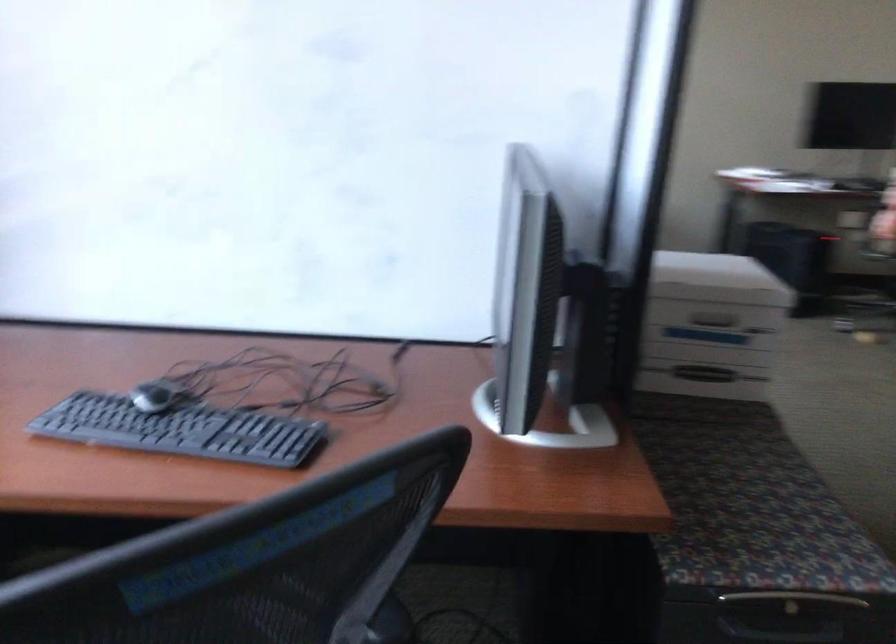
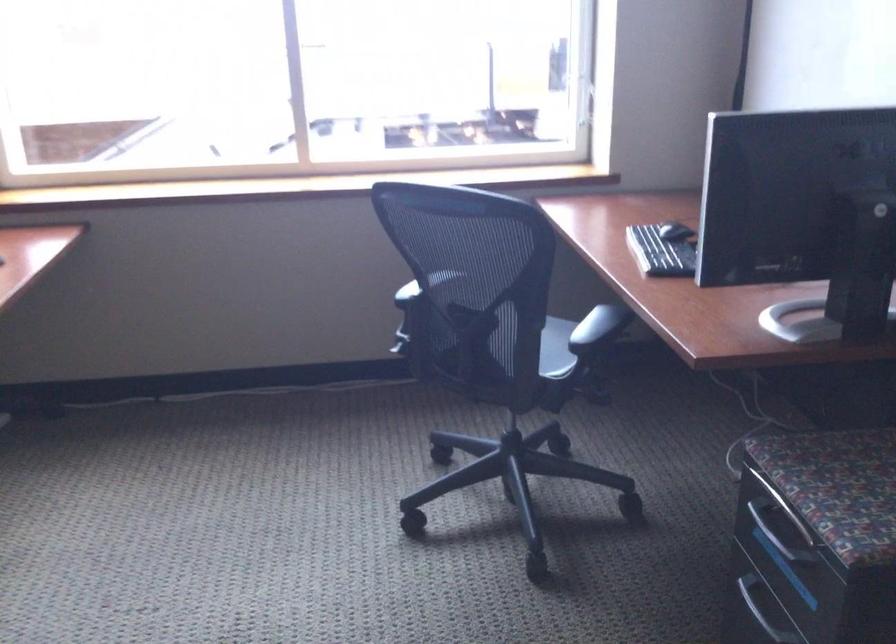
Where in the second image is the point corresponding to the point at 200,397 from the first image?

(676, 231)